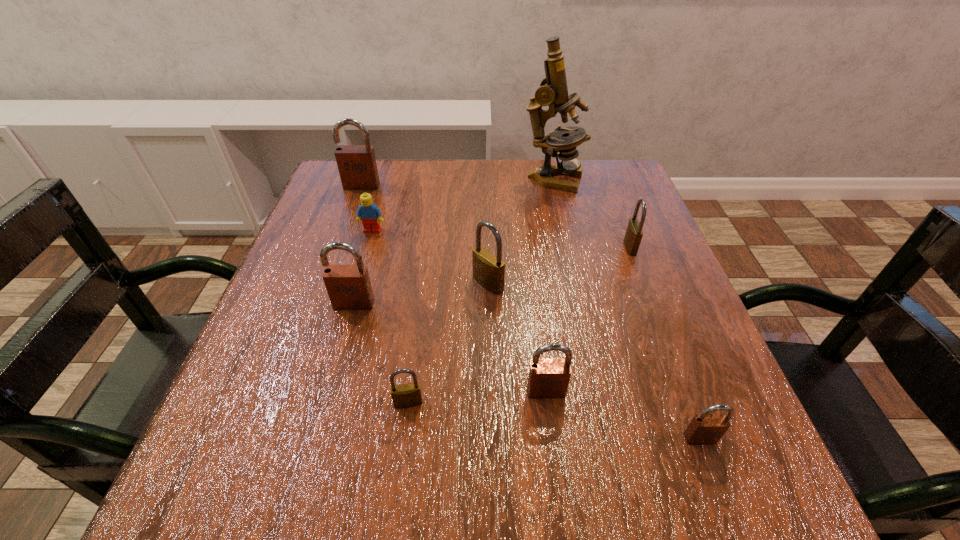
At what (x,y) coordinates should I click in order to perform the action: click on object that is at the far right corner. Please return your answer as a coordinate pair (x, y). Image resolution: width=960 pixels, height=540 pixels. Looking at the image, I should click on (553, 92).

Locate an element on the screen. The height and width of the screenshot is (540, 960). vacant space at the far edge of the desktop is located at coordinates (444, 194).

At what (x,y) coordinates should I click in order to perform the action: click on vacant region at the near edge. Please return your answer as a coordinate pair (x, y). Looking at the image, I should click on (390, 466).

Find the location of a particular element. The height and width of the screenshot is (540, 960). free location at the left edge of the desktop is located at coordinates (294, 295).

You are a GUI agent. You are given a task and a screenshot of the screen. Output one action in this format:
    pyautogui.click(x=<x>, y=<y>)
    Task: Click on the vacant space at the right edge of the desktop
    The image size is (960, 540).
    Given the screenshot: What is the action you would take?
    pyautogui.click(x=652, y=344)

Identify the location of vacant space at the far left corner of the desktop. The width and height of the screenshot is (960, 540). (336, 176).

Identify the location of vacant space at the far right corner. This screenshot has width=960, height=540. (586, 201).

Identify the location of vacant space at the near right corner of the desktop. (749, 450).

Image resolution: width=960 pixels, height=540 pixels. Find the location of `vacant area between the fifth object from right to left and the nearest brass padlock`. vacant area between the fifth object from right to left and the nearest brass padlock is located at coordinates (448, 343).

This screenshot has height=540, width=960. I want to click on free space between the tallest object and the farthest brown padlock, so click(x=457, y=183).